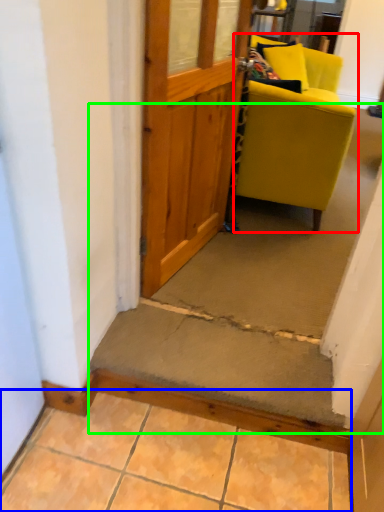
Question: Which object is the farthest from chair (highlighted by a red box)? Choose among these: concrete (highlighted by a blue box) or stairwell (highlighted by a green box).

Choices:
 (A) concrete
 (B) stairwell

Answer: (A)